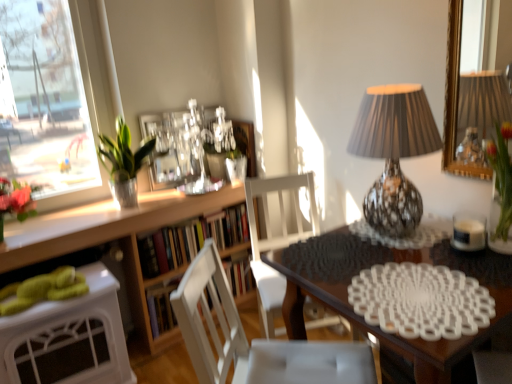
Locate an element on the screen. The image size is (512, 384). unoccupied area in front of white glass candle at right is located at coordinates (472, 268).